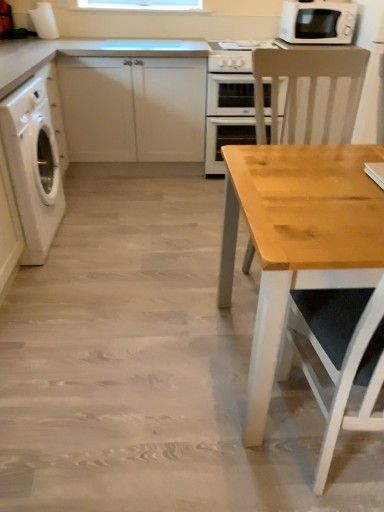
Question: From the image's perspective, is light wood chair at right over beige plastic microwave at upper right?

Choices:
 (A) no
 (B) yes

Answer: (A)

Question: Is light wood chair at right positioned with its back to beige plastic microwave at upper right?

Choices:
 (A) no
 (B) yes

Answer: (B)

Question: From the image's perspective, is light wood chair at right under beige plastic microwave at upper right?

Choices:
 (A) yes
 (B) no

Answer: (A)

Question: Considering the relative sizes of light wood chair at right and beige plastic microwave at upper right in the image provided, is light wood chair at right shorter than beige plastic microwave at upper right?

Choices:
 (A) no
 (B) yes

Answer: (A)

Question: Is light wood chair at right at the left side of beige plastic microwave at upper right?

Choices:
 (A) yes
 (B) no

Answer: (A)

Question: Is light wood chair at right behind beige plastic microwave at upper right?

Choices:
 (A) no
 (B) yes

Answer: (A)

Question: Can you confirm if natural wood table at right is smaller than white matte cabinet at left?

Choices:
 (A) yes
 (B) no

Answer: (A)

Question: Is natural wood table at right bigger than white matte cabinet at left?

Choices:
 (A) no
 (B) yes

Answer: (A)

Question: Considering the relative sizes of natural wood table at right and white matte cabinet at left in the image provided, is natural wood table at right wider than white matte cabinet at left?

Choices:
 (A) yes
 (B) no

Answer: (A)

Question: Is white matte cabinet at left located within natural wood table at right?

Choices:
 (A) no
 (B) yes

Answer: (A)

Question: From the image's perspective, is natural wood table at right located beneath white matte cabinet at left?

Choices:
 (A) no
 (B) yes

Answer: (B)

Question: Does natural wood table at right touch white matte cabinet at left?

Choices:
 (A) no
 (B) yes

Answer: (A)

Question: Does white glossy washing machine at left have a lesser width compared to beige plastic microwave at upper right?

Choices:
 (A) no
 (B) yes

Answer: (A)